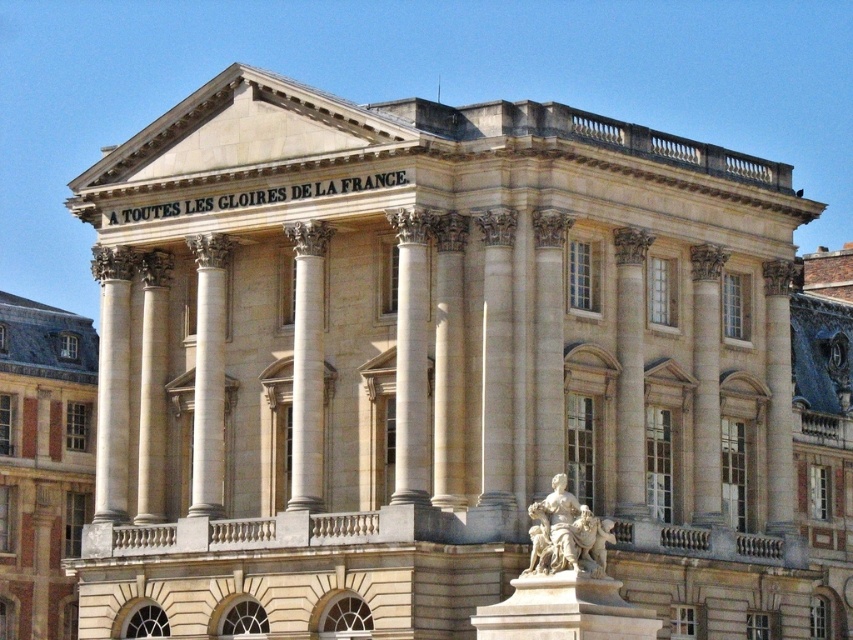
You are an architect analyzing the proportions of the beige stone building at left and the white marble statue at lower center in the image. Which object has a greater width?

Answer: The beige stone building at left has a greater width than the white marble statue at lower center.

You are a visitor standing in front of the beige stone building at left and the white marble statue at lower center. Which object is located to the right side of the other?

The white marble statue at lower center is located to the right of the beige stone building at left because the beige stone building at left is positioned on the left side of the white marble statue at lower center.